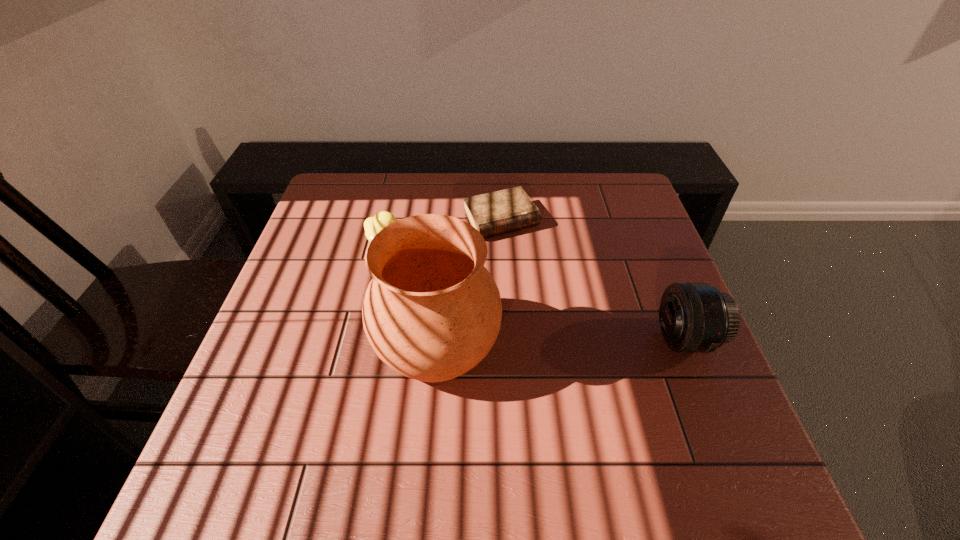
Where is `the tallest object`? This screenshot has width=960, height=540. the tallest object is located at coordinates (432, 312).

Locate an element on the screen. Image resolution: width=960 pixels, height=540 pixels. the third shortest object is located at coordinates (694, 317).

At what (x,y) coordinates should I click in order to perform the action: click on telephoto lens. Please return your answer as a coordinate pair (x, y). Looking at the image, I should click on (694, 317).

This screenshot has width=960, height=540. In order to click on duckling in this screenshot , I will do `click(372, 225)`.

Locate an element on the screen. The image size is (960, 540). the shortest object is located at coordinates (494, 213).

You are a GUI agent. You are given a task and a screenshot of the screen. Output one action in this format:
    pyautogui.click(x=<x>, y=<y>)
    Task: Click on the vacant space located 0.160m on the back of the tallest object
    
    Given the screenshot: What is the action you would take?
    pyautogui.click(x=444, y=255)

Where is `vacant space located 0.340m on the front-facing side of the telephoto lens`? Image resolution: width=960 pixels, height=540 pixels. vacant space located 0.340m on the front-facing side of the telephoto lens is located at coordinates coord(505,339).

Locate an element on the screen. free space located 0.120m on the front-facing side of the telephoto lens is located at coordinates (604, 339).

Image resolution: width=960 pixels, height=540 pixels. I want to click on vacant space situated 0.180m on the front-facing side of the telephoto lens, so click(577, 339).

Identify the location of free point located 0.200m on the beak of the second shortest object. The height and width of the screenshot is (540, 960). point(455,280).